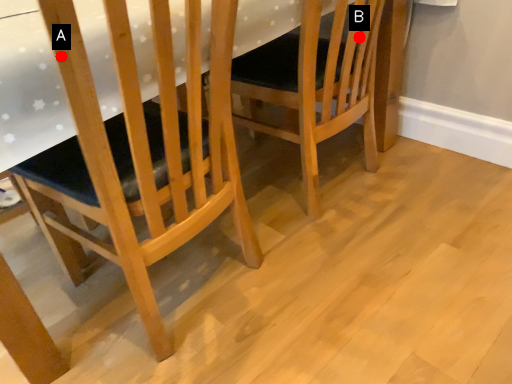
Question: Two points are circled on the image, labeled by A and B beside each circle. Which point is closer to the camera?

Choices:
 (A) A is closer
 (B) B is closer

Answer: (A)